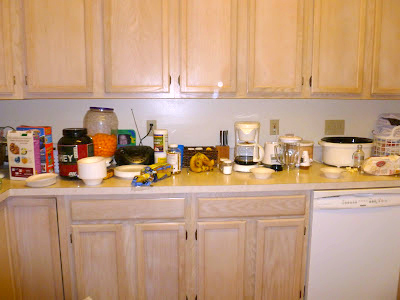
Locate an element on the screen. plastic bowls is located at coordinates (97, 170).